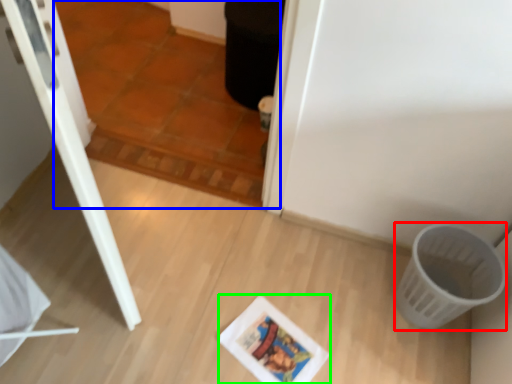
Question: Considering the real-world distances, which object is farthest from basket (highlighted by a red box)? tile (highlighted by a blue box) or comic book (highlighted by a green box)?

Choices:
 (A) tile
 (B) comic book

Answer: (A)